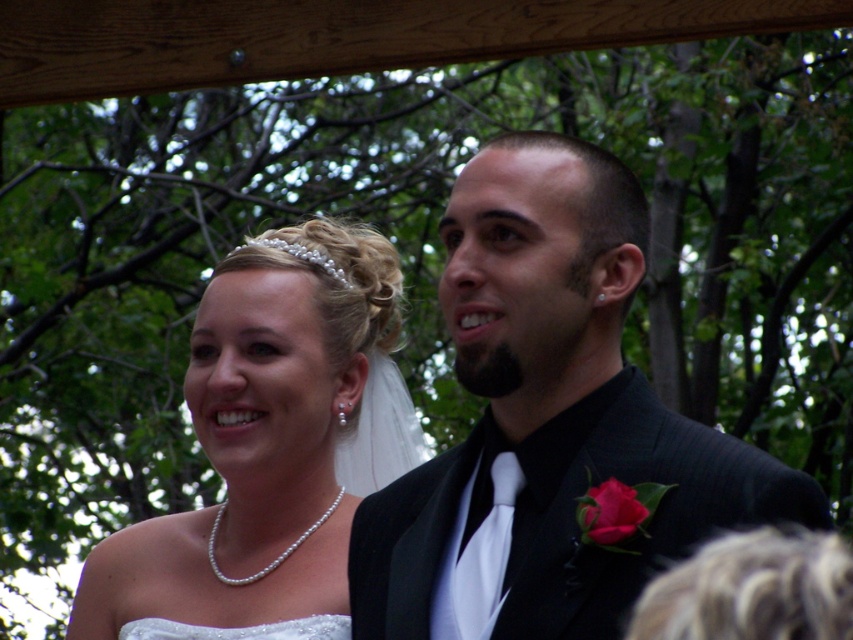
Does pearl necklace at upper left have a greater width compared to matte pink rose at lower right?

Correct, the width of pearl necklace at upper left exceeds that of matte pink rose at lower right.

At what (x,y) coordinates should I click in order to perform the action: click on pearl necklace at upper left. Please return your answer as a coordinate pair (x, y). This screenshot has width=853, height=640. Looking at the image, I should click on (271, 438).

From the picture: Who is lower down, matte pink rose at lower right or white satin dress at lower left?

white satin dress at lower left is lower down.

Is point (618, 545) farther from viewer compared to point (158, 627)?

No.

Locate an element on the screen. This screenshot has width=853, height=640. matte pink rose at lower right is located at coordinates (614, 512).

Who is lower down, pearl necklace at upper left or white satin dress at lower left?

white satin dress at lower left

The image size is (853, 640). Describe the element at coordinates (271, 438) in the screenshot. I see `pearl necklace at upper left` at that location.

At what (x,y) coordinates should I click in order to perform the action: click on pearl necklace at upper left. Please return your answer as a coordinate pair (x, y). Looking at the image, I should click on (271, 438).